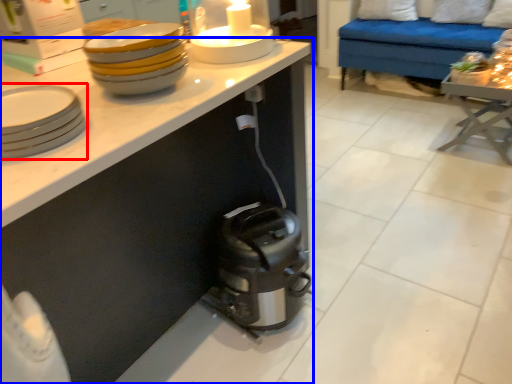
Question: Which of the following is the closest to the observer, tableware (highlighted by a red box) or cabinetry (highlighted by a blue box)?

Choices:
 (A) tableware
 (B) cabinetry

Answer: (A)